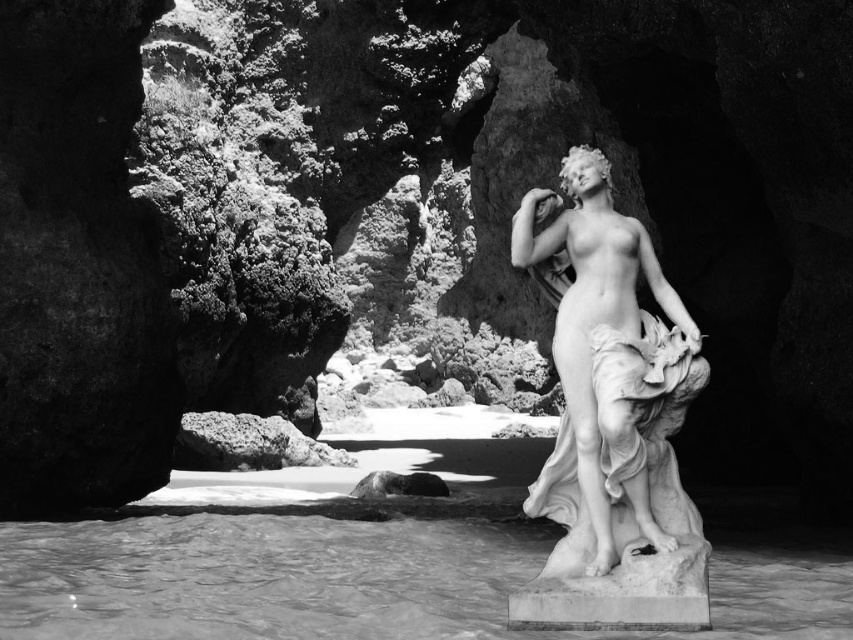
Question: Does translucent white water at lower center have a smaller size compared to white marble statue at center?

Choices:
 (A) yes
 (B) no

Answer: (B)

Question: Is translucent white water at lower center closer to camera compared to white marble statue at center?

Choices:
 (A) no
 (B) yes

Answer: (B)

Question: Which of the following is the closest to the observer?

Choices:
 (A) coord(339,628)
 (B) coord(643,529)

Answer: (A)

Question: Which point is farther from the camera taking this photo?

Choices:
 (A) (4, 609)
 (B) (686, 596)

Answer: (A)

Question: Does translucent white water at lower center appear on the left side of white marble statue at center?

Choices:
 (A) no
 (B) yes

Answer: (B)